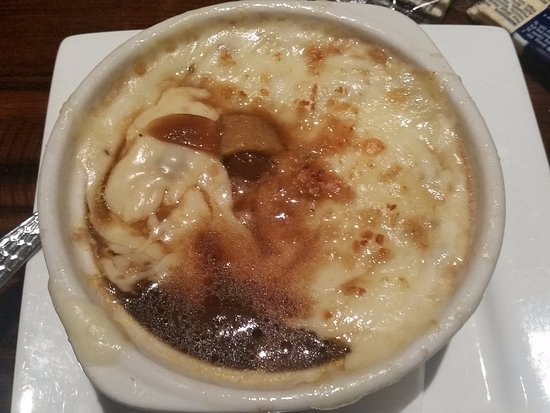
Where is `place to hold utensil`? place to hold utensil is located at coordinates (13, 237).